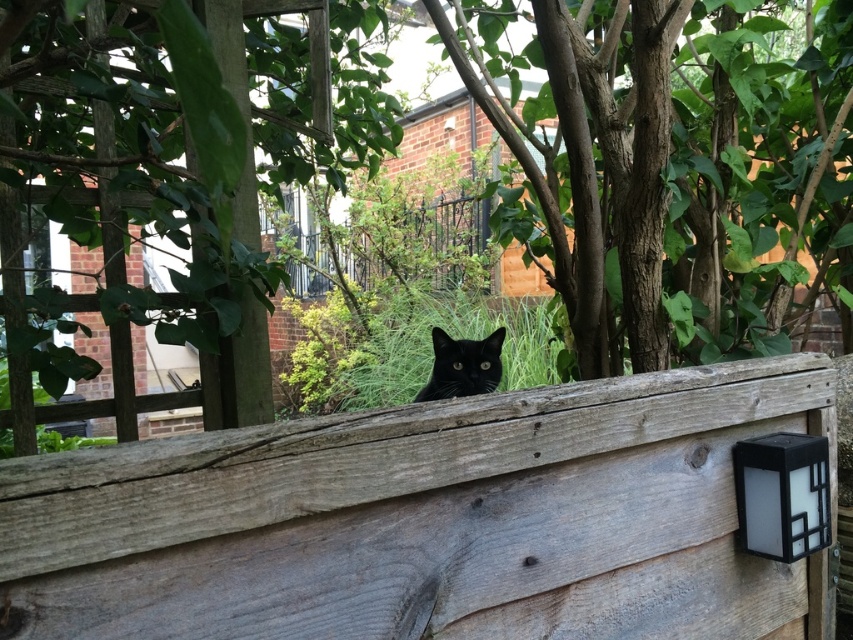
Consider the image. You are standing in the garden and see the green leafy tree at center and the white plastic lamp at upper right. Which object is positioned more to the right side of the scene?

The green leafy tree at center is positioned more to the right side of the scene than the white plastic lamp at upper right.

You are standing in the scene and want to place a small flag at the location of point (764, 160). However, there is an obstacle at point (206, 531). Can you determine if the flag will be visible from your current position?

Point (764, 160) is behind point (206, 531), so the flag placed at point (764, 160) will be obscured by the obstacle at point (206, 531) and thus not visible from your current position.

You are a gardener who wants to plant a new shrub between the green leafy tree at center and the weathered wood fence at center. Can you fit the shrub there if it requires 3 feet of space between the tree and the fence?

The distance between the green leafy tree at center and the weathered wood fence at center is 4.02 feet, which is more than the required 3 feet. Therefore, the shrub can be planted there with sufficient space.